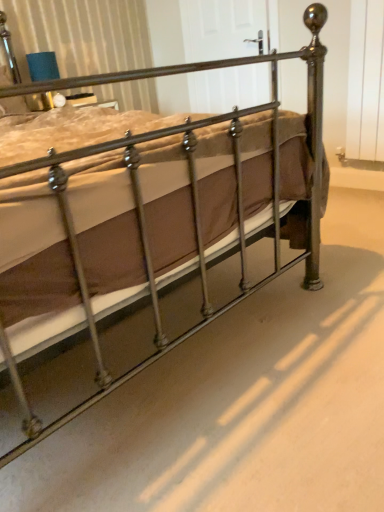
Where is `white matte door at upper center`? The width and height of the screenshot is (384, 512). white matte door at upper center is located at coordinates (222, 28).

What is the approximate height of white matte door at upper center?

white matte door at upper center is 31.38 inches in height.

Image resolution: width=384 pixels, height=512 pixels. What do you see at coordinates (222, 28) in the screenshot?
I see `white matte door at upper center` at bounding box center [222, 28].

Where is `white matte door at upper center`? The image size is (384, 512). white matte door at upper center is located at coordinates click(x=222, y=28).